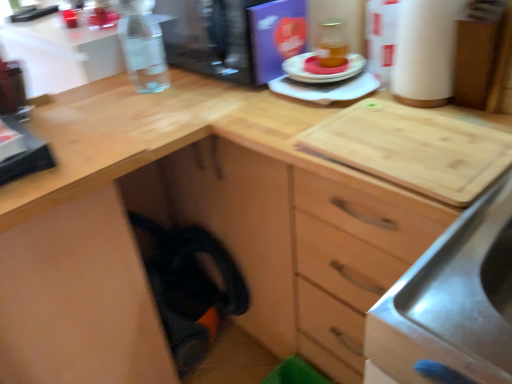
This screenshot has height=384, width=512. Identify the location of vacant area on the back side of clear glass bottle at upper left. (163, 74).